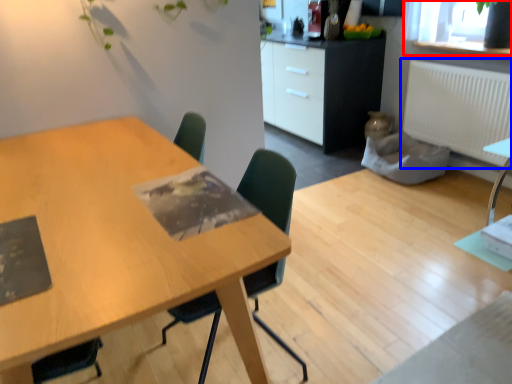
Question: Which object appears closest to the camera in this image, window screen (highlighted by a red box) or radiator (highlighted by a blue box)?

Choices:
 (A) window screen
 (B) radiator

Answer: (A)